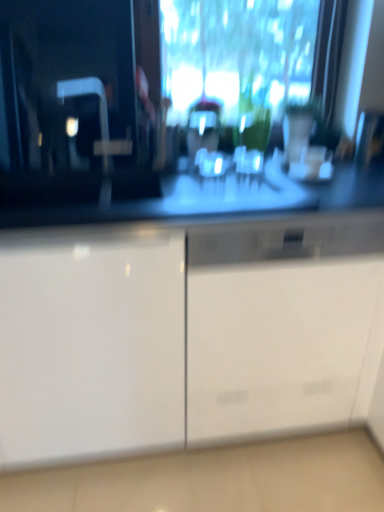
The image size is (384, 512). What do you see at coordinates (91, 343) in the screenshot?
I see `white glossy cabinet at left` at bounding box center [91, 343].

Looking at this image, in order to face white glossy cabinet at left, should I rotate leftwards or rightwards?

You should rotate left by 16.615 degrees.

Image resolution: width=384 pixels, height=512 pixels. Identify the location of white glossy cabinet at left. (91, 343).

Describe the element at coordinates (282, 326) in the screenshot. This screenshot has width=384, height=512. I see `white glossy cabinet at center` at that location.

Find the location of a particular element. white glossy cabinet at center is located at coordinates (282, 326).

Find the location of a particular element. white glossy cabinet at left is located at coordinates (91, 343).

Considering the relative positions of white glossy cabinet at left and white glossy cabinet at center in the image provided, is white glossy cabinet at left to the left of white glossy cabinet at center from the viewer's perspective?

Yes.

Is white glossy cabinet at left behind white glossy cabinet at center?

No.

Does point (149, 280) come closer to viewer compared to point (335, 273)?

Yes, it is in front of point (335, 273).

From the image's perspective, is white glossy cabinet at left located above or below white glossy cabinet at center?

Based on their image positions, white glossy cabinet at left is located above white glossy cabinet at center.

From a real-world perspective, is white glossy cabinet at left physically above white glossy cabinet at center?

Indeed, from a real-world perspective, white glossy cabinet at left stands above white glossy cabinet at center.

Between white glossy cabinet at left and white glossy cabinet at center, which one has smaller width?

white glossy cabinet at center is thinner.

Considering the sizes of white glossy cabinet at left and white glossy cabinet at center in the image, is white glossy cabinet at left taller or shorter than white glossy cabinet at center?

Clearly, white glossy cabinet at left is taller compared to white glossy cabinet at center.

Which of these two, white glossy cabinet at left or white glossy cabinet at center, is smaller?

white glossy cabinet at center.

Do you think white glossy cabinet at left is within white glossy cabinet at center, or outside of it?

white glossy cabinet at left is spatially situated outside white glossy cabinet at center.

Can you see white glossy cabinet at left touching white glossy cabinet at center?

white glossy cabinet at left and white glossy cabinet at center are clearly separated.

Consider the image. Could you tell me if white glossy cabinet at left is turned towards white glossy cabinet at center?

No, white glossy cabinet at left is not turned towards white glossy cabinet at center.

How different are the orientations of white glossy cabinet at left and white glossy cabinet at center in degrees?

0.00134 degrees.

How much distance is there between white glossy cabinet at left and white glossy cabinet at center?

white glossy cabinet at left is 11.62 inches away from white glossy cabinet at center.

At what (x,y) coordinates should I click in order to perform the action: click on cabinetry above the white glossy cabinet at center (from the image's perspective). Please return your answer as a coordinate pair (x, y). The height and width of the screenshot is (512, 384). Looking at the image, I should click on (91, 343).

Visually, is white glossy cabinet at center positioned to the left or to the right of white glossy cabinet at left?

Clearly, white glossy cabinet at center is on the right of white glossy cabinet at left in the image.

Which object is further away from the camera, white glossy cabinet at center or white glossy cabinet at left?

white glossy cabinet at center is more distant.

Is point (190, 406) in front of point (86, 385)?

No, it is behind (86, 385).

From the image's perspective, is white glossy cabinet at center above or below white glossy cabinet at left?

white glossy cabinet at center is situated lower than white glossy cabinet at left in the image.

From a real-world perspective, does white glossy cabinet at center stand above white glossy cabinet at left?

No.

Considering the sizes of white glossy cabinet at center and white glossy cabinet at left in the image, is white glossy cabinet at center wider or thinner than white glossy cabinet at left?

white glossy cabinet at center is thinner than white glossy cabinet at left.

Considering the relative sizes of white glossy cabinet at center and white glossy cabinet at left in the image provided, is white glossy cabinet at center taller than white glossy cabinet at left?

In fact, white glossy cabinet at center may be shorter than white glossy cabinet at left.

Can you confirm if white glossy cabinet at center is smaller than white glossy cabinet at left?

Yes, white glossy cabinet at center is smaller than white glossy cabinet at left.

Is white glossy cabinet at center positioned beyond the bounds of white glossy cabinet at left?

Yes.

Is the surface of white glossy cabinet at center in direct contact with white glossy cabinet at left?

white glossy cabinet at center is not next to white glossy cabinet at left, and they're not touching.

Is white glossy cabinet at center looking in the opposite direction of white glossy cabinet at left?

white glossy cabinet at center is not turned away from white glossy cabinet at left.

How far apart are white glossy cabinet at center and white glossy cabinet at left?

white glossy cabinet at center and white glossy cabinet at left are 11.62 inches apart.

Where is `cabinetry located above the white glossy cabinet at center (from a real-world perspective)`? The image size is (384, 512). cabinetry located above the white glossy cabinet at center (from a real-world perspective) is located at coordinates (91, 343).

I want to click on file cabinet behind the white glossy cabinet at left, so click(282, 326).

The image size is (384, 512). In order to click on cabinetry lying in front of the white glossy cabinet at center in this screenshot , I will do `click(91, 343)`.